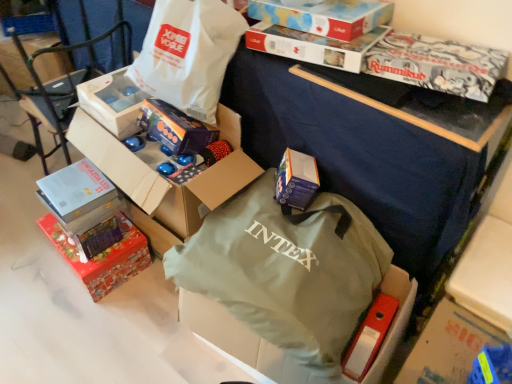
Locate an element on the screen. This screenshot has width=512, height=384. free space on the front side of red glossy gift box at lower left, which appears as the 5th box when viewed from the top is located at coordinates (78, 321).